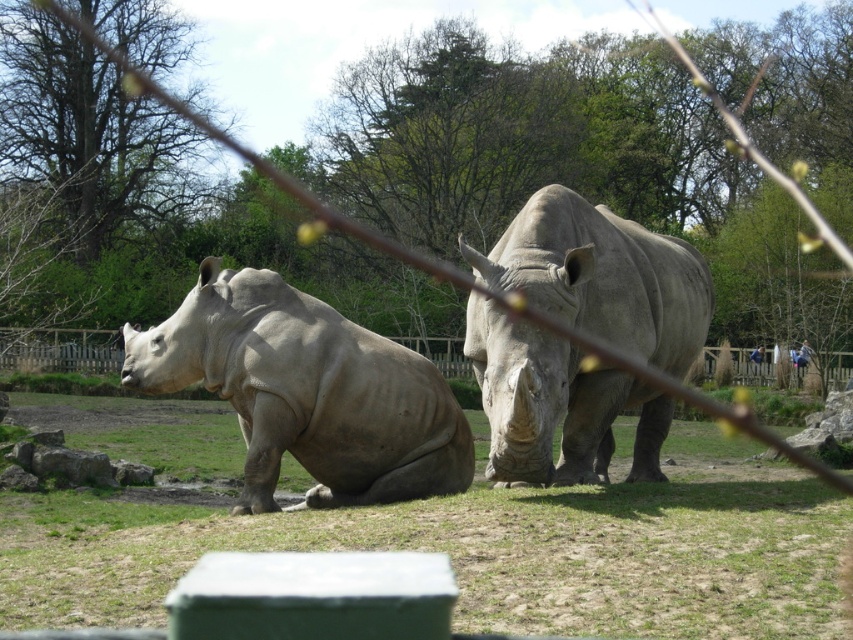
Which is in front, point (308, 316) or point (563, 340)?

Point (563, 340)

Is matte gray rhinoceros at left to the right of gray matte rhinoceros at center from the viewer's perspective?

Incorrect, matte gray rhinoceros at left is not on the right side of gray matte rhinoceros at center.

Locate an element on the screen. The image size is (853, 640). matte gray rhinoceros at left is located at coordinates (306, 392).

I want to click on matte gray rhinoceros at left, so click(x=306, y=392).

Does green grass at center appear under matte gray rhinoceros at left?

Correct, green grass at center is located below matte gray rhinoceros at left.

Consider the image. Who is shorter, green grass at center or matte gray rhinoceros at left?

Standing shorter between the two is green grass at center.

Identify the location of green grass at center. This screenshot has width=853, height=640. (486, 548).

Is point (100, 625) in front of point (578, 355)?

Yes.

Does point (381, 525) come in front of point (538, 291)?

Yes, point (381, 525) is closer to viewer.

I want to click on green grass at center, so click(x=486, y=548).